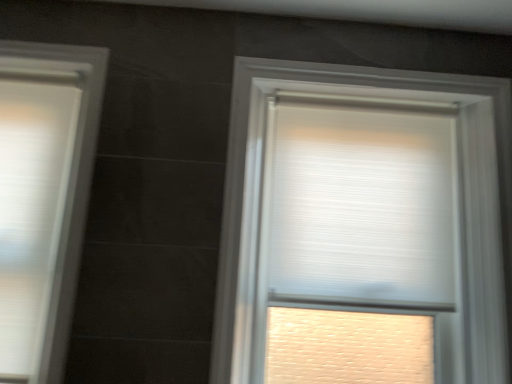
Question: Is white pleated blind at upper center not near white textured roller blind at center, which is the second window from left to right?

Choices:
 (A) yes
 (B) no

Answer: (B)

Question: Considering the relative positions of white pleated blind at upper center and white textured roller blind at center, which is the second window from left to right, in the image provided, is white pleated blind at upper center to the right of white textured roller blind at center, which is the second window from left to right, from the viewer's perspective?

Choices:
 (A) yes
 (B) no

Answer: (A)

Question: From the image's perspective, is white pleated blind at upper center located above white textured roller blind at center, which is the second window from left to right?

Choices:
 (A) yes
 (B) no

Answer: (A)

Question: Is white pleated blind at upper center further to camera compared to white textured roller blind at center, arranged as the first window when viewed from the right?

Choices:
 (A) yes
 (B) no

Answer: (A)

Question: Is white pleated blind at upper center surrounding white textured roller blind at center, arranged as the first window when viewed from the right?

Choices:
 (A) no
 (B) yes

Answer: (B)

Question: From the image's perspective, is white textured roller blind at center, which is the second window from left to right, above or below white pleated blind at upper center?

Choices:
 (A) above
 (B) below

Answer: (B)

Question: Is white textured roller blind at center, which is the second window from left to right, in front of or behind white pleated blind at upper center in the image?

Choices:
 (A) front
 (B) behind

Answer: (A)

Question: From a real-world perspective, is white textured roller blind at center, arranged as the first window when viewed from the right, positioned above or below white pleated blind at upper center?

Choices:
 (A) above
 (B) below

Answer: (B)

Question: Looking at their shapes, would you say white textured roller blind at center, arranged as the first window when viewed from the right, is wider or thinner than white pleated blind at upper center?

Choices:
 (A) thin
 (B) wide

Answer: (B)

Question: In the image, is white textured roller blind at center, which is the second window from left to right, on the left side or the right side of white matte window at left, acting as the first window starting from the left?

Choices:
 (A) left
 (B) right

Answer: (B)

Question: Is point (475, 89) positioned closer to the camera than point (16, 190)?

Choices:
 (A) closer
 (B) farther

Answer: (B)

Question: Is white textured roller blind at center, arranged as the first window when viewed from the right, wider or thinner than white matte window at left, which is the second window in right-to-left order?

Choices:
 (A) thin
 (B) wide

Answer: (B)

Question: From a real-world perspective, is white textured roller blind at center, arranged as the first window when viewed from the right, physically located above or below white matte window at left, which is the second window in right-to-left order?

Choices:
 (A) above
 (B) below

Answer: (A)

Question: Is white pleated blind at upper center in front of or behind white textured roller blind at center, which is the second window from left to right, in the image?

Choices:
 (A) behind
 (B) front

Answer: (A)

Question: From a real-world perspective, is white pleated blind at upper center positioned above or below white textured roller blind at center, which is the second window from left to right?

Choices:
 (A) above
 (B) below

Answer: (A)